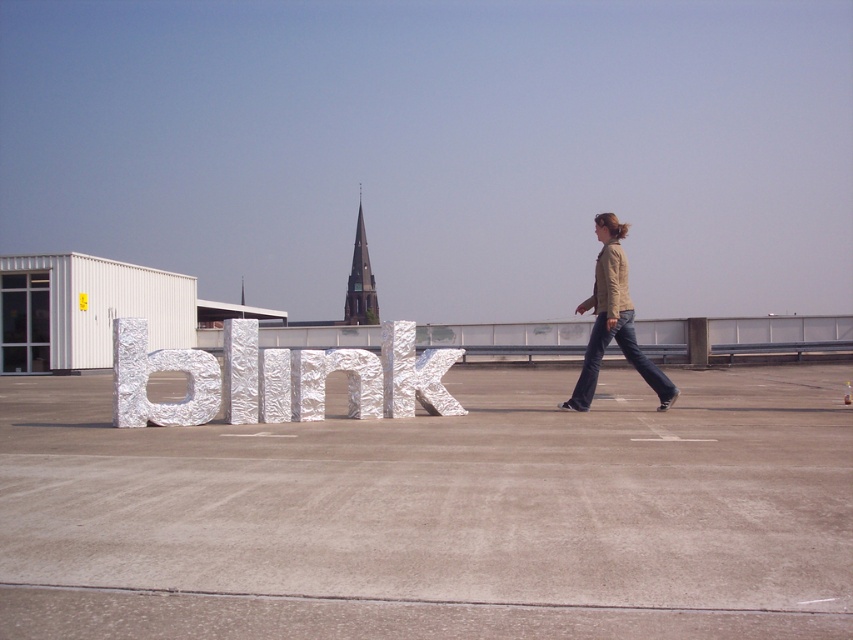
In the scene shown: You are standing at the center of the white concrete tarmac at center. You want to walk towards the church steeple. Which direction should you walk?

The white concrete tarmac at center is located at point (437,513). Since the church steeple is behind the white industrial building on the left side of the image, you should walk towards the left direction to reach the church steeple.

You are standing on the rooftop and want to take a photo of the shiny metallic letter at center. Which direction should you face to ensure the letter is in the center of your camera view?

The shiny metallic letter at center is located at point coordinates, so facing the center of the image will ensure it is in the camera view.

You are a delivery drone that needs to land on the white concrete tarmac at center. The shiny metallic letter at center is in the way. Can you safely land on the tarmac without hitting the letter?

The white concrete tarmac at center is bigger than the shiny metallic letter at center, so there is enough space to land safely without hitting the letter.